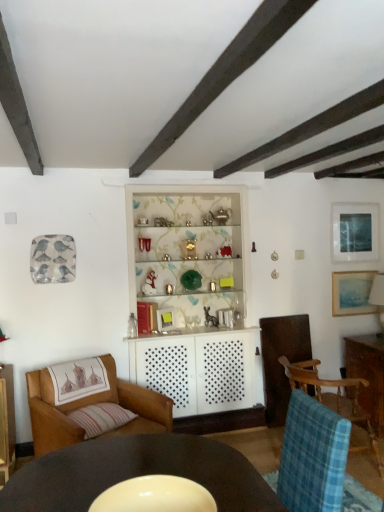
Question: From the image's perspective, relative to brown leather chair at lower left, placed as the second chair when sorted from right to left, is smooth dark wood table at lower center above or below?

Choices:
 (A) above
 (B) below

Answer: (A)

Question: Relative to brown leather chair at lower left, placed as the second chair when sorted from right to left, is smooth dark wood table at lower center in front or behind?

Choices:
 (A) behind
 (B) front

Answer: (B)

Question: Which of these objects is positioned closest to the matte blue painting at upper right, the second picture frame positioned from the bottom?

Choices:
 (A) blue plaid fabric chair at lower right, the first chair in the right-to-left sequence
 (B) smooth dark wood table at lower center
 (C) striped fabric pillow at lower left
 (D) matte blue painting at upper right, arranged as the 1th picture frame when ordered from the bottom
 (E) brown leather chair at lower left, the first chair positioned from the left

Answer: (D)

Question: Which is farther from the blue plaid fabric chair at lower right, the first chair in the right-to-left sequence?

Choices:
 (A) white textured cabinet at center
 (B) matte blue painting at upper right, the first picture frame viewed from the top
 (C) striped fabric pillow at lower left
 (D) matte blue painting at upper right, arranged as the 1th picture frame when ordered from the bottom
 (E) smooth dark wood table at lower center

Answer: (E)